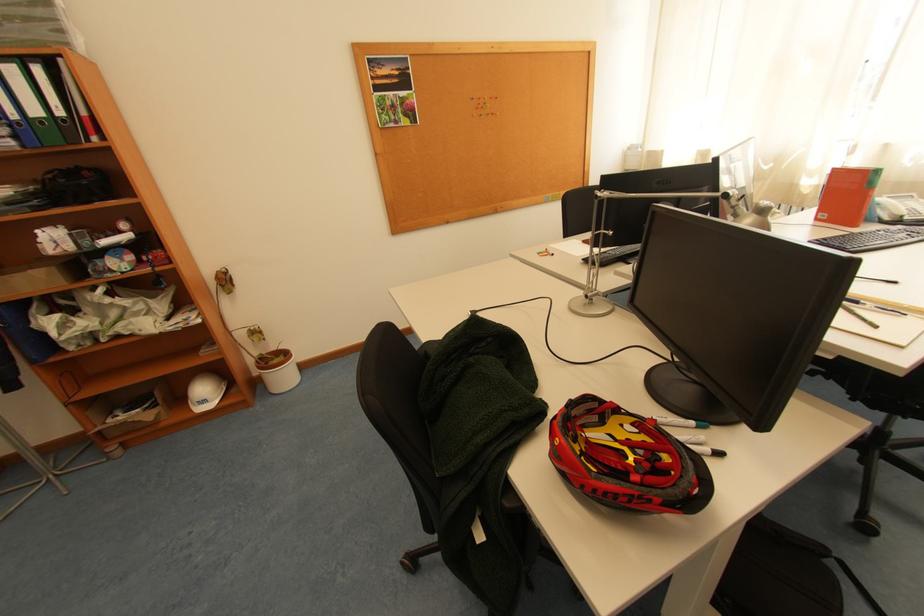
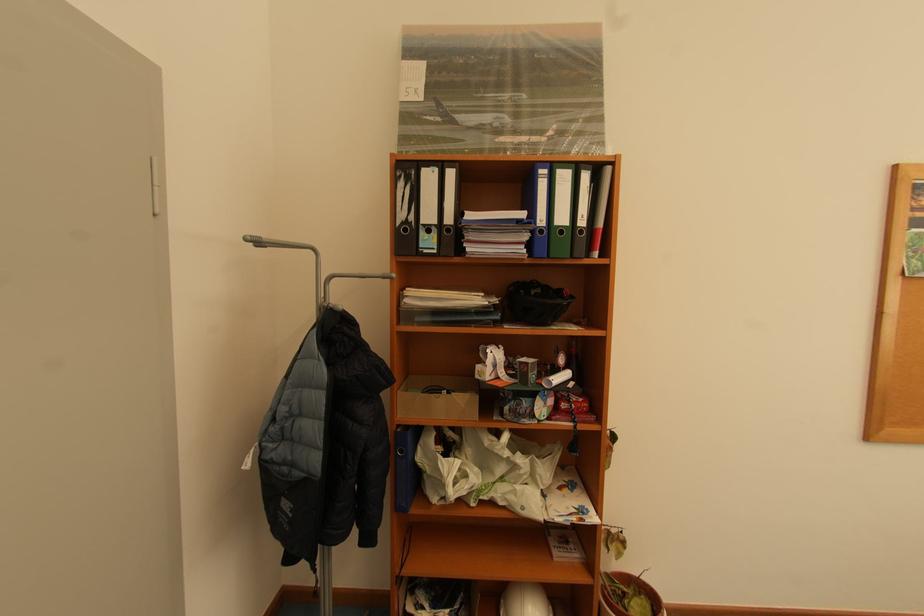
Locate, in the second image, the point that corresponds to the point at 360,46 in the first image.

(904, 167)